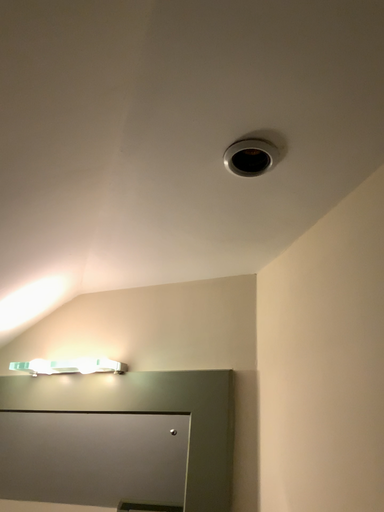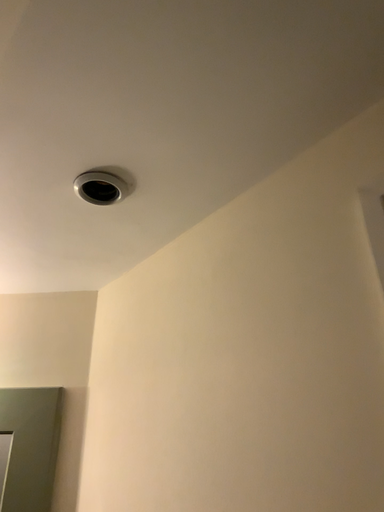
Question: How did the camera likely rotate when shooting the video?

Choices:
 (A) rotated left
 (B) rotated right

Answer: (B)